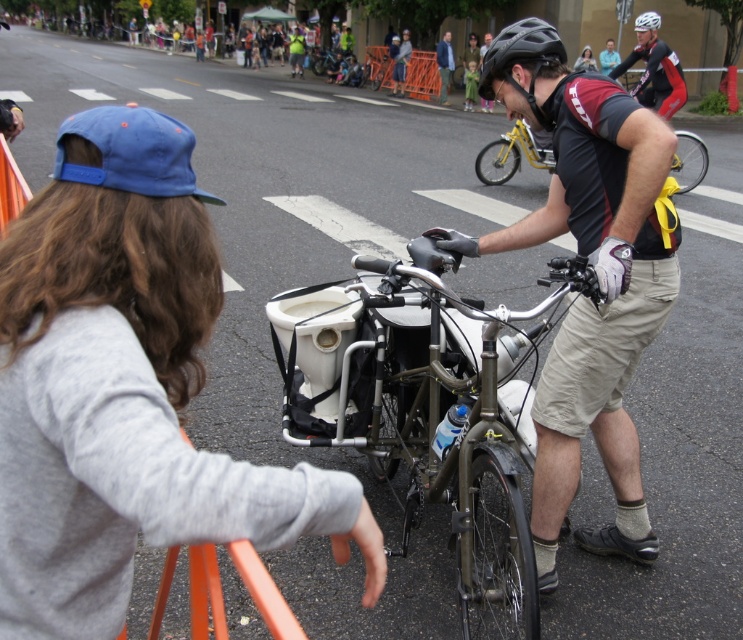
Question: Is matte black helmet at center smaller than black cycling jersey at center?

Choices:
 (A) no
 (B) yes

Answer: (A)

Question: Which of these objects is positioned farthest from the blue denim jacket at upper center?

Choices:
 (A) gray cotton sweatshirt at upper left
 (B) black matte bicycle helmet at center
 (C) metallic silver bicycle at center

Answer: (A)

Question: Which object is positioned farthest from the black matte bicycle helmet at upper center?

Choices:
 (A) black matte bicycle helmet at center
 (B) metallic silver bicycle at center
 (C) yellow metallic bicycle at center

Answer: (B)

Question: Considering the relative positions of yellow metallic bicycle at center and black matte bicycle helmet at upper center in the image provided, where is yellow metallic bicycle at center located with respect to black matte bicycle helmet at upper center?

Choices:
 (A) above
 (B) below

Answer: (B)

Question: Can you confirm if gray cotton sweatshirt at upper left is positioned below black matte bicycle helmet at upper center?

Choices:
 (A) no
 (B) yes

Answer: (B)

Question: Estimate the real-world distances between objects in this image. Which object is closer to the black matte bicycle helmet at center?

Choices:
 (A) black cycling jersey at center
 (B) matte black helmet at center
 (C) yellow metallic bicycle at center

Answer: (B)